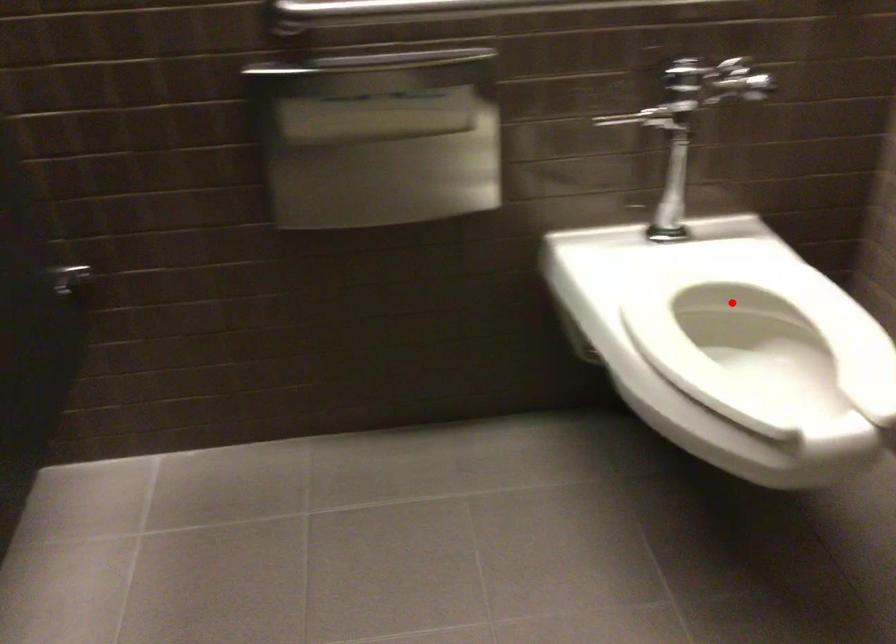
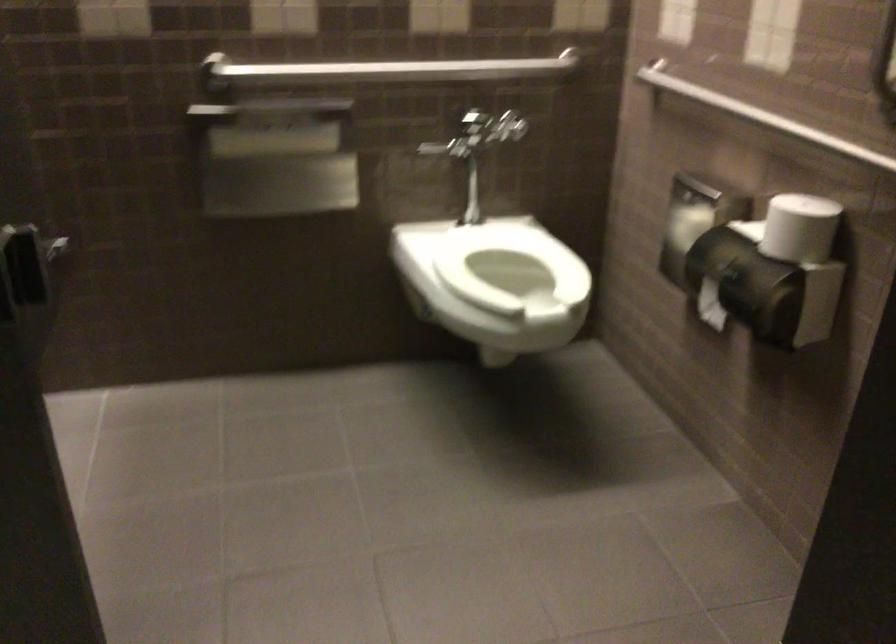
Locate, in the second image, the point that corresponds to the highlighted location in the first image.

(509, 263)